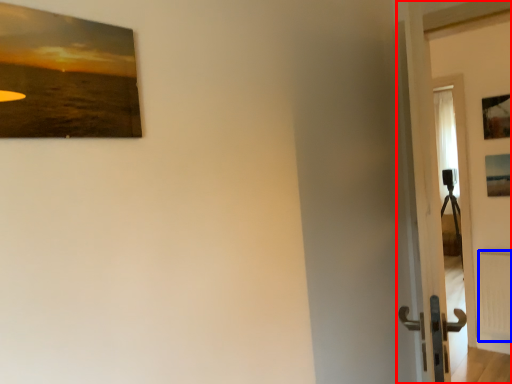
Question: Which object appears closest to the camera in this image, door (highlighted by a red box) or radiator (highlighted by a blue box)?

Choices:
 (A) door
 (B) radiator

Answer: (A)